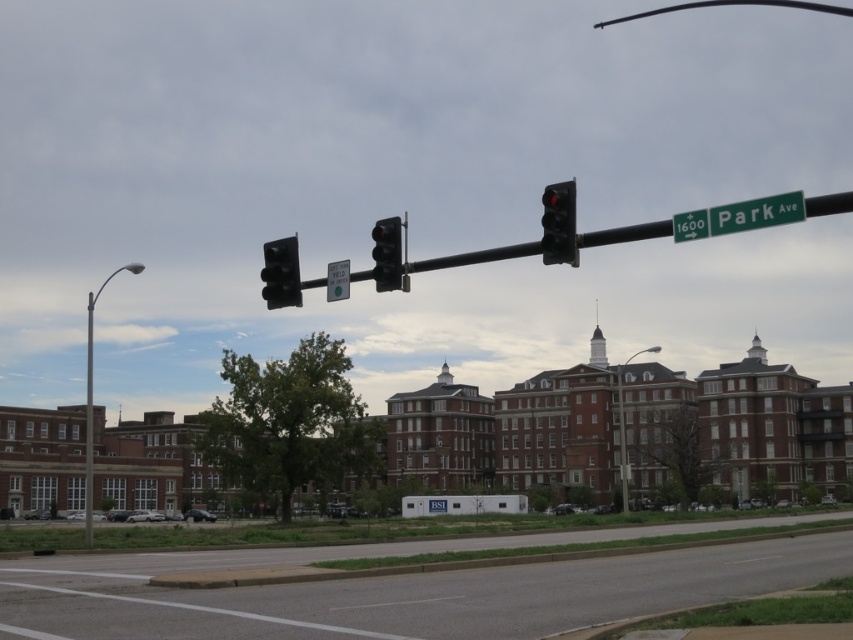
Who is more forward, (575, 192) or (384, 234)?

Point (575, 192) is in front.

Between matte black traffic light at upper right and matte black traffic light at center, which one appears on the left side from the viewer's perspective?

From the viewer's perspective, matte black traffic light at center appears more on the left side.

The height and width of the screenshot is (640, 853). Describe the element at coordinates (560, 224) in the screenshot. I see `matte black traffic light at upper right` at that location.

Locate an element on the screen. This screenshot has height=640, width=853. matte black traffic light at upper right is located at coordinates (560, 224).

The height and width of the screenshot is (640, 853). What do you see at coordinates (281, 273) in the screenshot?
I see `black glass traffic light at upper center` at bounding box center [281, 273].

Is point (271, 269) in front of point (393, 276)?

No, it is behind (393, 276).

At what (x,y) coordinates should I click in order to perform the action: click on black glass traffic light at upper center. Please return your answer as a coordinate pair (x, y). The width and height of the screenshot is (853, 640). Looking at the image, I should click on (281, 273).

Is matte black traffic light at upper right bigger than metallic silver streetlight at center?

Correct, matte black traffic light at upper right is larger in size than metallic silver streetlight at center.

Between matte black traffic light at upper right and metallic silver streetlight at center, which one has less height?

With less height is metallic silver streetlight at center.

Locate an element on the screen. matte black traffic light at upper right is located at coordinates [x=560, y=224].